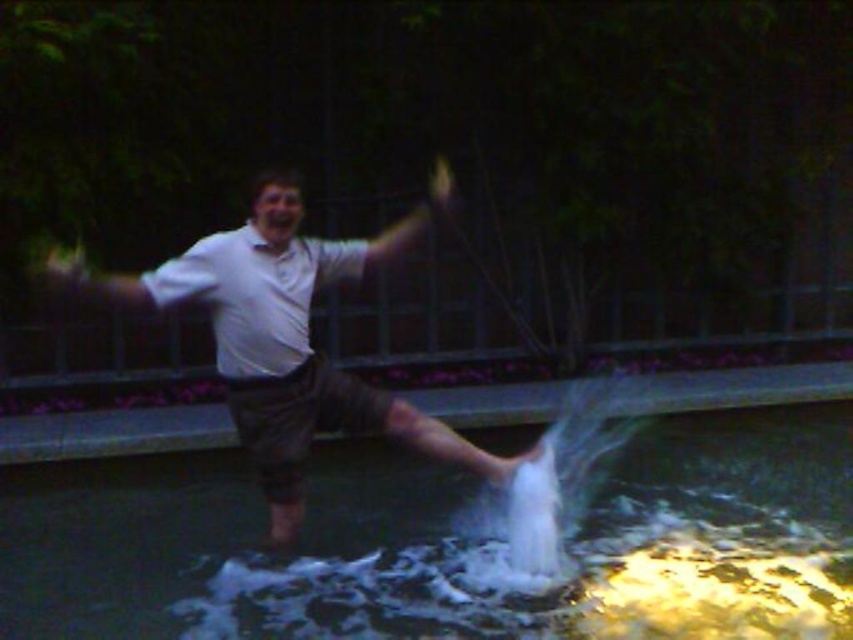
You are a photographer trying to capture the perfect shot of the scene. You want to ensure that the white frothy water at center and the white cotton shirt at center are both visible in the frame. Which object should you focus on to make sure both are in focus?

The white frothy water at center is bigger than the white cotton shirt at center, so focusing on the white frothy water at center will ensure both are in focus since it is larger and occupies more of the frame.